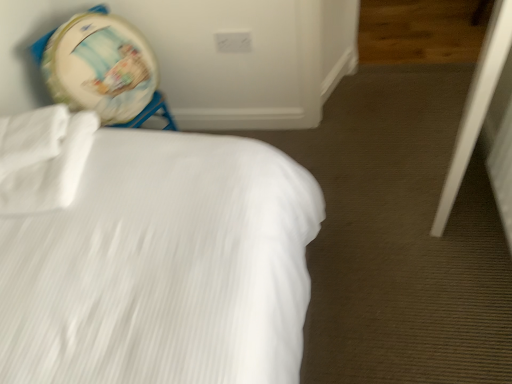
Question: Can you confirm if white plastic screen door at lower right is positioned to the right of white matte sheet at upper left?

Choices:
 (A) no
 (B) yes

Answer: (B)

Question: Is white plastic screen door at lower right wider than white matte sheet at upper left?

Choices:
 (A) no
 (B) yes

Answer: (A)

Question: Is white matte sheet at upper left a part of white plastic screen door at lower right?

Choices:
 (A) yes
 (B) no

Answer: (B)

Question: Is white plastic screen door at lower right not inside white matte sheet at upper left?

Choices:
 (A) no
 (B) yes

Answer: (B)

Question: Is white plastic screen door at lower right positioned in front of white matte sheet at upper left?

Choices:
 (A) yes
 (B) no

Answer: (A)

Question: Considering the relative positions of white plastic screen door at lower right and white matte sheet at upper left in the image provided, is white plastic screen door at lower right to the left of white matte sheet at upper left from the viewer's perspective?

Choices:
 (A) yes
 (B) no

Answer: (B)

Question: From a real-world perspective, is white textured bed at upper left positioned under white matte sheet at upper left based on gravity?

Choices:
 (A) no
 (B) yes

Answer: (B)

Question: Is white textured bed at upper left to the left of white matte sheet at upper left from the viewer's perspective?

Choices:
 (A) yes
 (B) no

Answer: (B)

Question: Is white textured bed at upper left wider than white matte sheet at upper left?

Choices:
 (A) no
 (B) yes

Answer: (B)

Question: From the image's perspective, is white textured bed at upper left above white matte sheet at upper left?

Choices:
 (A) no
 (B) yes

Answer: (A)

Question: Is white matte sheet at upper left at the back of white textured bed at upper left?

Choices:
 (A) yes
 (B) no

Answer: (A)

Question: From the image's perspective, would you say white textured bed at upper left is shown under white matte sheet at upper left?

Choices:
 (A) yes
 (B) no

Answer: (A)

Question: From the image's perspective, is white matte sheet at upper left beneath white plastic screen door at lower right?

Choices:
 (A) yes
 (B) no

Answer: (A)